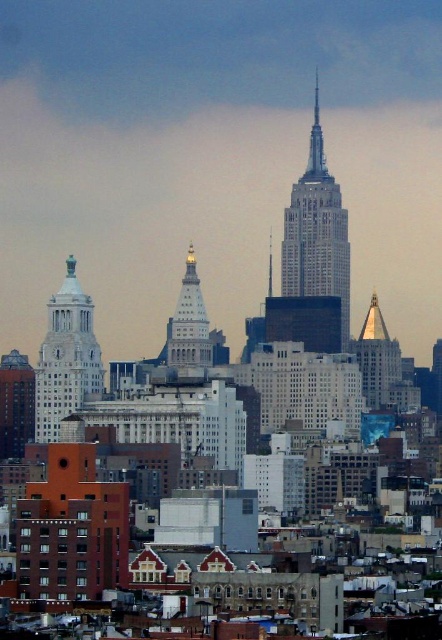
You are a photographer planning to capture the Empire State Building from a distance. You have a camera with a limited field of view. Which object, the white stone tower at center or the gold reflective spire at center, will occupy more space in your photo?

The white stone tower at center is bigger than the gold reflective spire at center, so it will occupy more space in the photo.

You are standing in the middle of the New York City skyline scene. There are two points marked in the image, point 1 at coordinates (x=312, y=164) and point 2 at coordinates (x=171, y=346). Which point is closer to you?

Point 2 at coordinates (x=171, y=346) is closer to you because it is less further to the camera than point 1 at coordinates (x=312, y=164).

Based on the scene description, which object is larger between the white stone tower at center and the white marble tower at center?

The white stone tower at center is larger than the white marble tower at center according to the description.